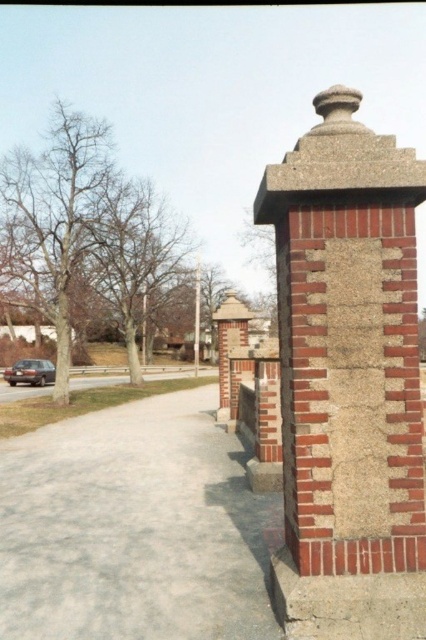
Question: Does red brick chimney at right lie behind gray concrete pavement at lower left?

Choices:
 (A) yes
 (B) no

Answer: (A)

Question: Can you confirm if red brick chimney at right is thinner than gray concrete pavement at lower left?

Choices:
 (A) no
 (B) yes

Answer: (B)

Question: Which object appears farthest from the camera in this image?

Choices:
 (A) gray concrete pavement at lower left
 (B) red brick chimney at right

Answer: (B)

Question: Which point is closer to the camera?

Choices:
 (A) red brick chimney at right
 (B) gray concrete pavement at lower left

Answer: (B)

Question: Considering the relative positions of red brick chimney at right and gray concrete pavement at lower left in the image provided, where is red brick chimney at right located with respect to gray concrete pavement at lower left?

Choices:
 (A) left
 (B) right

Answer: (B)